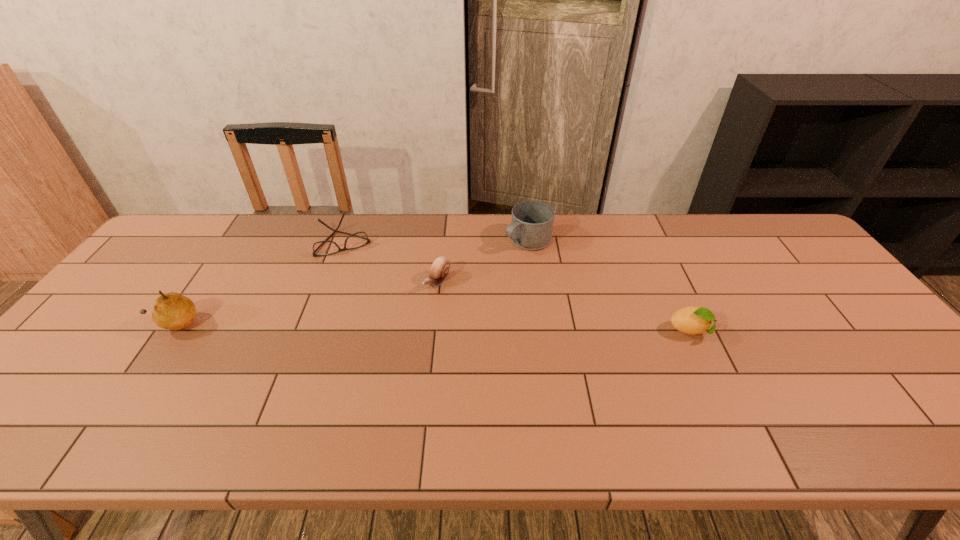
Locate an element on the screen. The width and height of the screenshot is (960, 540). the leftmost object is located at coordinates (172, 311).

Identify the location of the rightmost object. (692, 320).

I want to click on the second tallest object, so click(x=531, y=228).

Image resolution: width=960 pixels, height=540 pixels. I want to click on mug, so click(531, 228).

This screenshot has height=540, width=960. I want to click on the second object from left to right, so click(322, 248).

Where is `the shortest object`? The width and height of the screenshot is (960, 540). the shortest object is located at coordinates (322, 248).

You are a GUI agent. You are given a task and a screenshot of the screen. Output one action in this format:
    pyautogui.click(x=<x>, y=<y>)
    Task: Click on the escargot
    The height and width of the screenshot is (540, 960).
    Given the screenshot: What is the action you would take?
    pyautogui.click(x=439, y=270)

At what (x,y) coordinates should I click in order to perform the action: click on the third farthest object. Please return your answer as a coordinate pair (x, y). The height and width of the screenshot is (540, 960). Looking at the image, I should click on (439, 270).

What are the coordinates of `vacant space located 0.330m on the right of the pear` in the screenshot? It's located at [x=325, y=324].

This screenshot has height=540, width=960. Find the location of `vacant space situated 0.220m with leaves positioned above the lemon`. vacant space situated 0.220m with leaves positioned above the lemon is located at coordinates (799, 332).